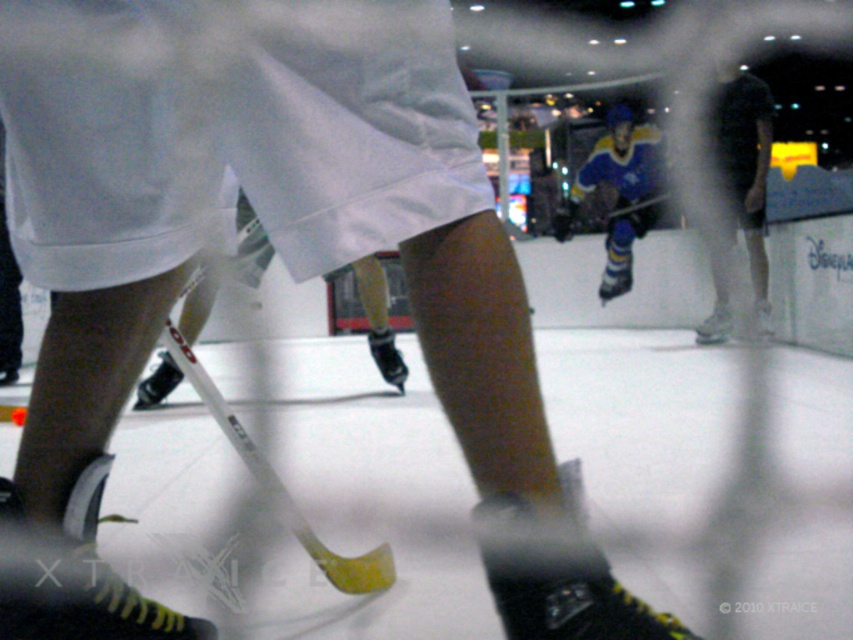
You are a referee at the ice rink and need to determine which of the two points, point (761, 161) or point (643, 145), is closer to you. Based on the scene, which point is nearer?

Point (761, 161) is closer to the viewer than point (643, 145).